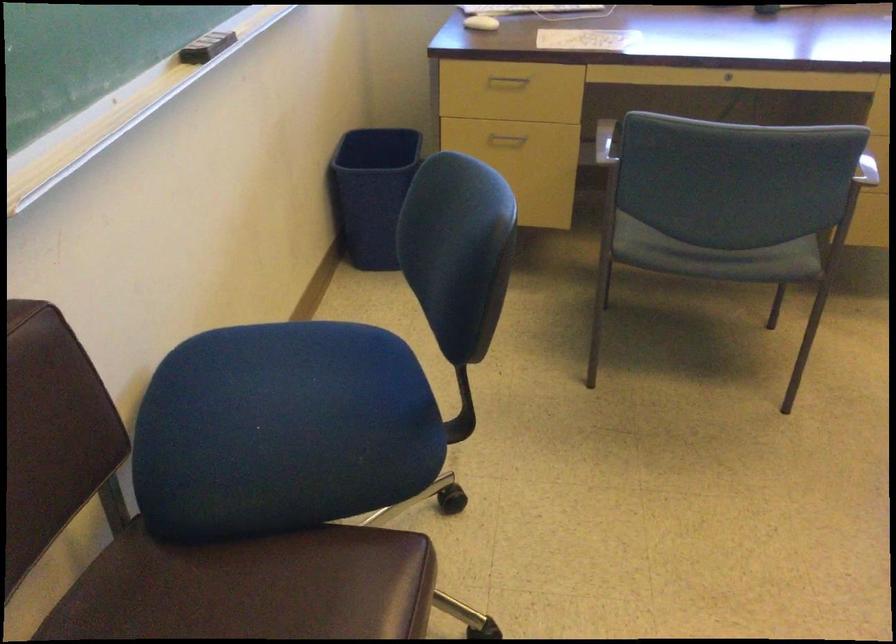
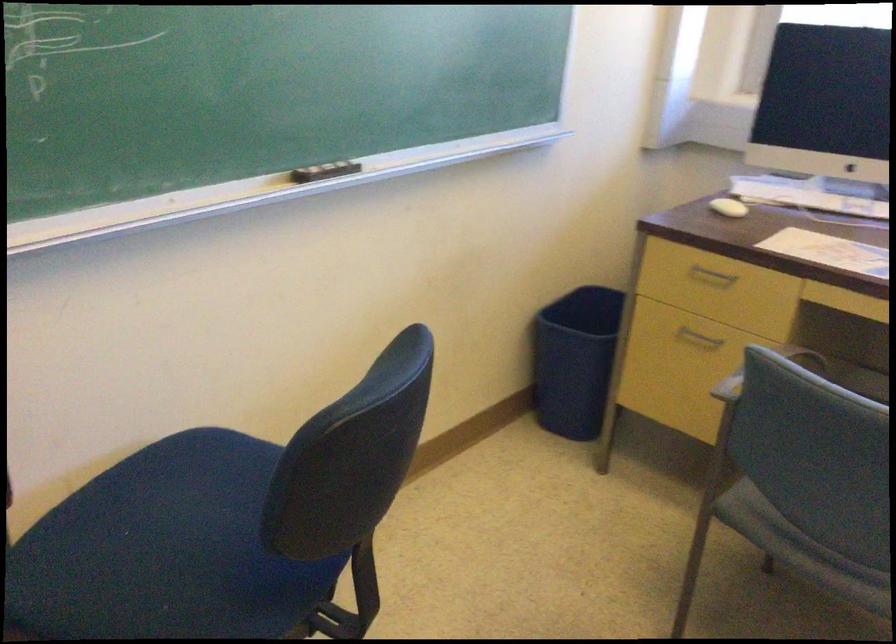
Where in the second image is the point corresponding to (500,140) from the first image?

(698, 337)